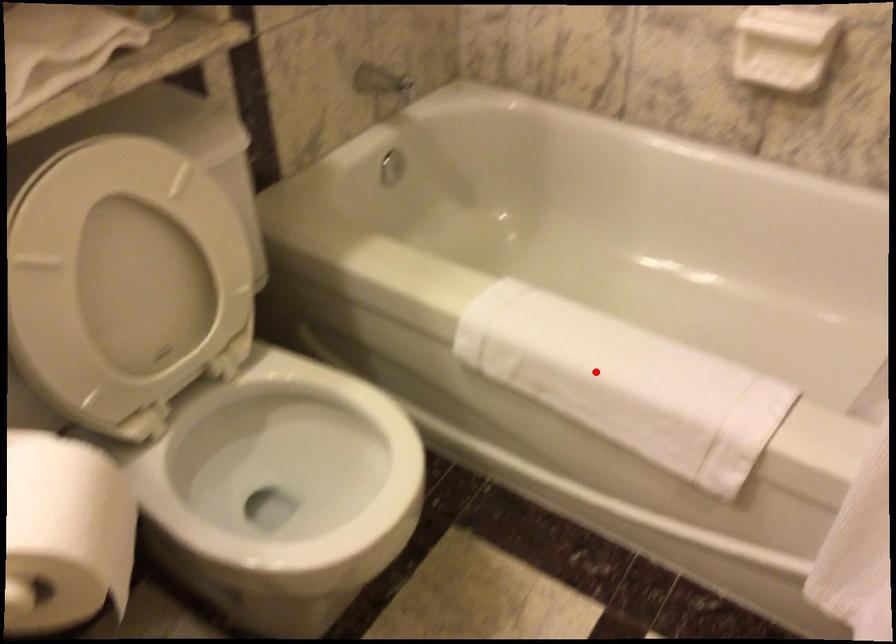
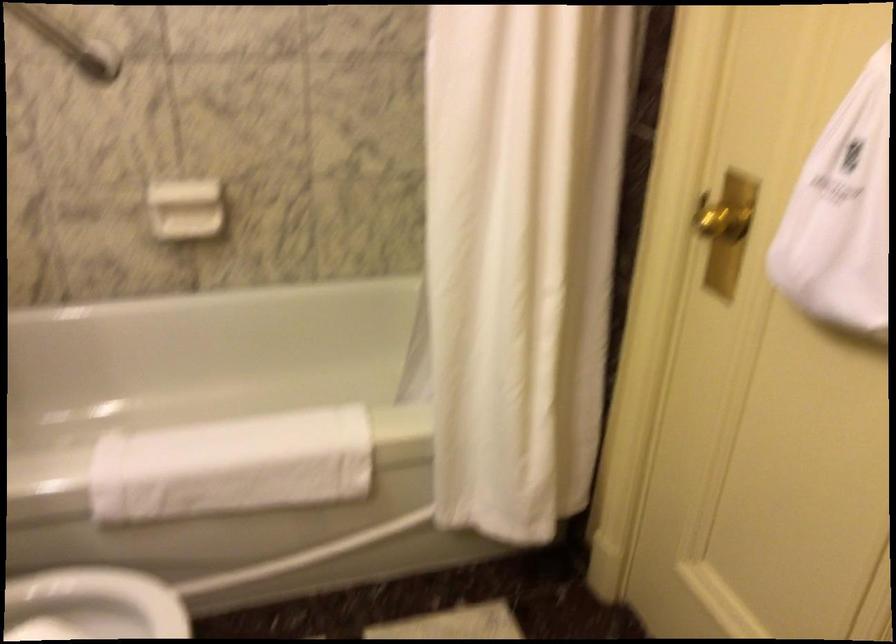
Question: I am providing you with two images of the same scene from different viewpoints. Image1 has a red point marked. In image2, the corresponding 3D location appears at what relative position? Reply with the corresponding letter.

Choices:
 (A) Closer
 (B) Farther

Answer: (B)